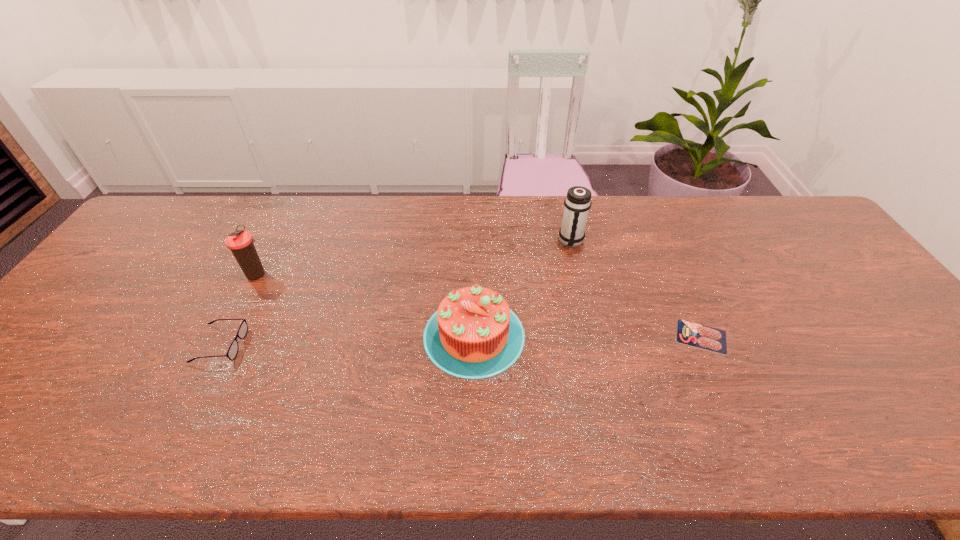
The image size is (960, 540). In order to click on vacant point located between the nearer thermos bottle and the second shortest object in this screenshot , I will do `click(239, 309)`.

Locate an element on the screen. Image resolution: width=960 pixels, height=540 pixels. empty space between the spectacles and the cake is located at coordinates click(x=348, y=340).

Where is `unoccupied area between the shortest object and the third tallest object`? The width and height of the screenshot is (960, 540). unoccupied area between the shortest object and the third tallest object is located at coordinates (588, 336).

Find the location of a particular element. The height and width of the screenshot is (540, 960). vacant area that lies between the right thermos bottle and the third shortest object is located at coordinates (522, 288).

The height and width of the screenshot is (540, 960). Identify the location of vacant point located between the third tallest object and the farthest object. (522, 288).

Find the location of a particular element. This screenshot has width=960, height=540. free spot between the cake and the spectacles is located at coordinates 348,340.

Locate an element on the screen. This screenshot has height=540, width=960. object that is the second closest one to the right thermos bottle is located at coordinates (688, 333).

Image resolution: width=960 pixels, height=540 pixels. In order to click on the third closest object to the salami in this screenshot , I will do `click(232, 352)`.

You are a GUI agent. You are given a task and a screenshot of the screen. Output one action in this format:
    pyautogui.click(x=<x>, y=<y>)
    Task: Click on the vacant area that satisfies the following two spatial constraints: 1. on the front side of the third tallest object; 2. on the front-facing side of the fourth tallest object
    
    Given the screenshot: What is the action you would take?
    pyautogui.click(x=474, y=345)

Where is `blank area in the image that satisfies the following two spatial constraints: 1. on the front side of the nearer thermos bottle; 2. on the front-facing side of the spectacles`? blank area in the image that satisfies the following two spatial constraints: 1. on the front side of the nearer thermos bottle; 2. on the front-facing side of the spectacles is located at coordinates (222, 345).